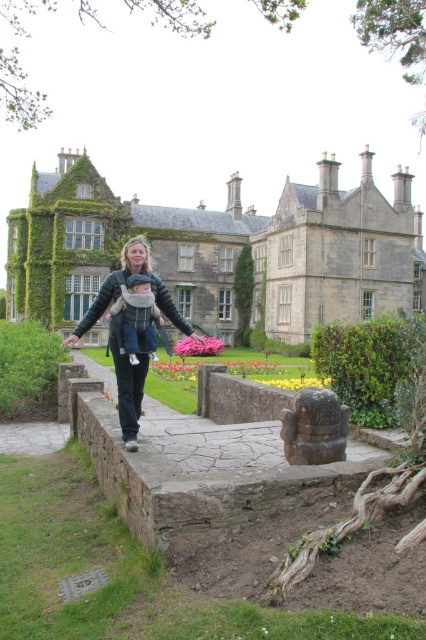
You are standing on the stone pathway and see the stone at center and the denim jacket at center. Which object is closer to you?

The stone at center is closer to the viewer than the denim jacket at center.

You are a photographer standing at the end of the stone pathway. You want to take a photo of the woman carrying the baby so that both the stone at center and the denim jacket at center are visible in the frame. Which object should be placed to the right side in the photo?

The stone at center is positioned on the right side of denim jacket at center, so in the photo, the stone at center should be placed to the right side of the denim jacket at center to ensure both are visible.